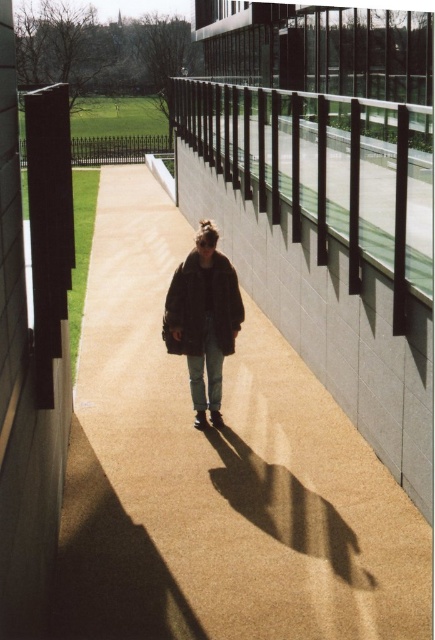
Question: Which object appears farthest from the camera in this image?

Choices:
 (A) dark brown leather jacket at center
 (B) brown textured pavement at center

Answer: (A)

Question: Which point is closer to the camera?

Choices:
 (A) (257, 557)
 (B) (198, 419)

Answer: (A)

Question: Does brown textured pavement at center appear on the left side of dark brown leather jacket at center?

Choices:
 (A) no
 (B) yes

Answer: (B)

Question: Is brown textured pavement at center below dark brown leather jacket at center?

Choices:
 (A) yes
 (B) no

Answer: (A)

Question: Can you confirm if brown textured pavement at center is wider than dark brown leather jacket at center?

Choices:
 (A) no
 (B) yes

Answer: (B)